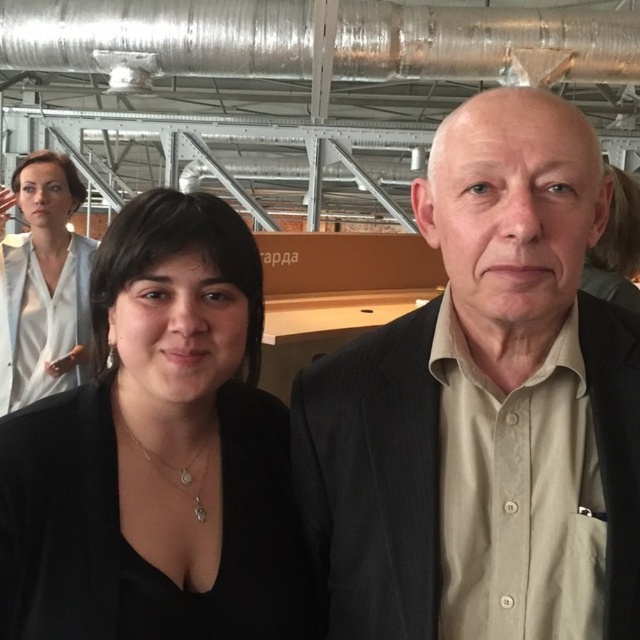
Is black matte shirt at center to the left of white shirt at upper left from the viewer's perspective?

Incorrect, black matte shirt at center is not on the left side of white shirt at upper left.

Image resolution: width=640 pixels, height=640 pixels. Describe the element at coordinates (157, 452) in the screenshot. I see `black matte shirt at center` at that location.

The image size is (640, 640). In order to click on black matte shirt at center in this screenshot , I will do `click(157, 452)`.

Between beige cotton shirt at center and white shirt at upper left, which one appears on the left side from the viewer's perspective?

From the viewer's perspective, white shirt at upper left appears more on the left side.

In the scene shown: Can you confirm if beige cotton shirt at center is thinner than white shirt at upper left?

No.

The image size is (640, 640). Identify the location of beige cotton shirt at center. (476, 385).

Is beige cotton shirt at center wider than black matte shirt at center?

Indeed, beige cotton shirt at center has a greater width compared to black matte shirt at center.

Who is taller, beige cotton shirt at center or black matte shirt at center?

beige cotton shirt at center is taller.

Locate an element on the screen. beige cotton shirt at center is located at coordinates (476, 385).